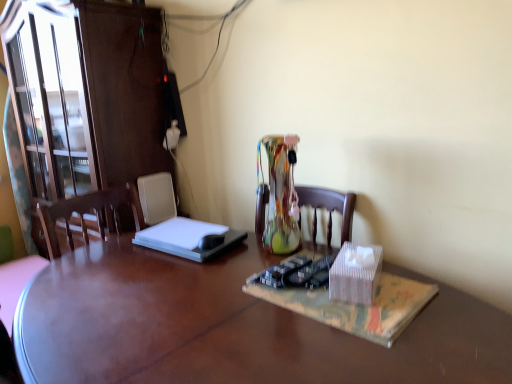
Question: Is white cardboard box at center taller or shorter than translucent plastic book at center?

Choices:
 (A) short
 (B) tall

Answer: (B)

Question: Is white cardboard box at center in front of or behind translucent plastic book at center in the image?

Choices:
 (A) front
 (B) behind

Answer: (B)

Question: Considering the real-world distances, which object is closest to the white cardboard box at center?

Choices:
 (A) matte brown cabinet at left
 (B) translucent plastic book at center
 (C) wooden desk at center

Answer: (B)

Question: Which object is positioned farthest from the translucent plastic book at center?

Choices:
 (A) white cardboard box at center
 (B) wooden desk at center
 (C) matte brown cabinet at left

Answer: (C)